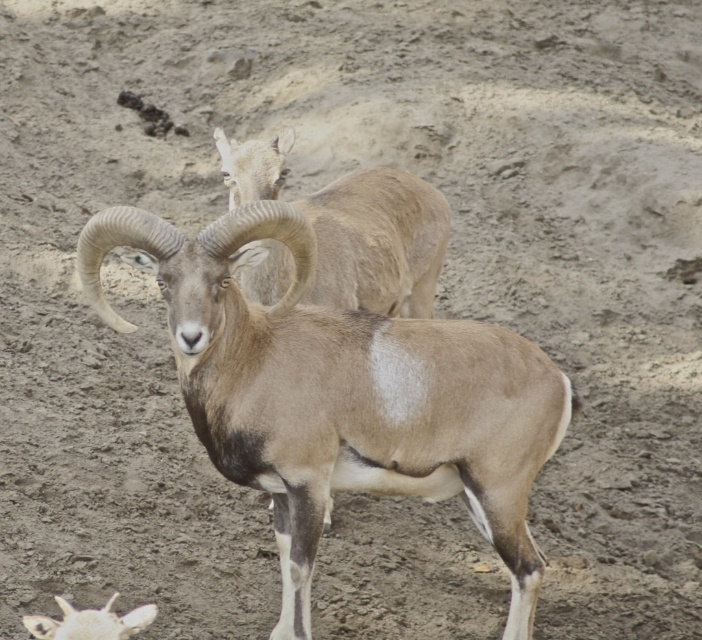
Question: Among these points, which one is farthest from the camera?

Choices:
 (A) (303, 394)
 (B) (128, 625)

Answer: (A)

Question: Is light brown woolen goat at upper center closer to the viewer compared to white woolen sheep at lower left?

Choices:
 (A) yes
 (B) no

Answer: (B)

Question: Is light brown woolen goat at upper center wider than white woolen sheep at lower left?

Choices:
 (A) no
 (B) yes

Answer: (B)

Question: Can you confirm if brown woolen goat at center is thinner than white woolen sheep at lower left?

Choices:
 (A) no
 (B) yes

Answer: (A)

Question: Based on their relative distances, which object is nearer to the white woolen sheep at lower left?

Choices:
 (A) light brown woolen goat at upper center
 (B) brown woolen goat at center

Answer: (B)

Question: Among these objects, which one is farthest from the camera?

Choices:
 (A) light brown woolen goat at upper center
 (B) white woolen sheep at lower left
 (C) brown woolen goat at center

Answer: (A)